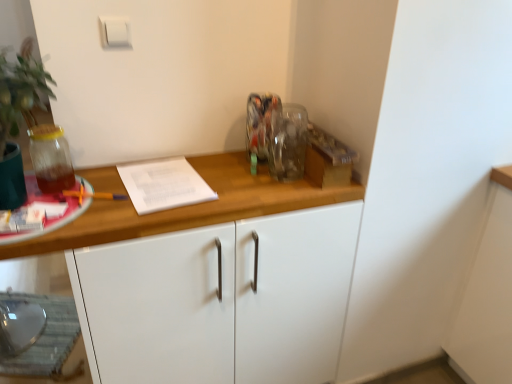
The width and height of the screenshot is (512, 384). Identify the location of free space in front of translucent glass jar at left. (54, 207).